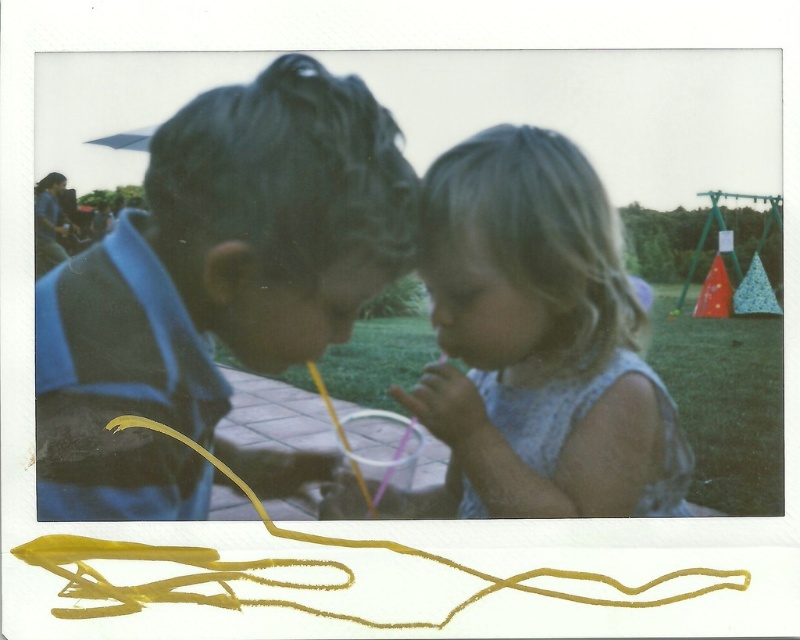
Question: Does blue striped shirt at left appear on the right side of light blue fabric dress at center?

Choices:
 (A) no
 (B) yes

Answer: (A)

Question: Which of the following is the closest to the observer?

Choices:
 (A) (178, 314)
 (B) (554, 292)

Answer: (A)

Question: In this image, where is blue striped shirt at left located relative to light blue fabric dress at center?

Choices:
 (A) right
 (B) left

Answer: (B)

Question: Does blue striped shirt at left appear over light blue fabric dress at center?

Choices:
 (A) no
 (B) yes

Answer: (B)

Question: Which object appears closest to the camera in this image?

Choices:
 (A) blue striped shirt at left
 (B) light blue fabric dress at center

Answer: (A)